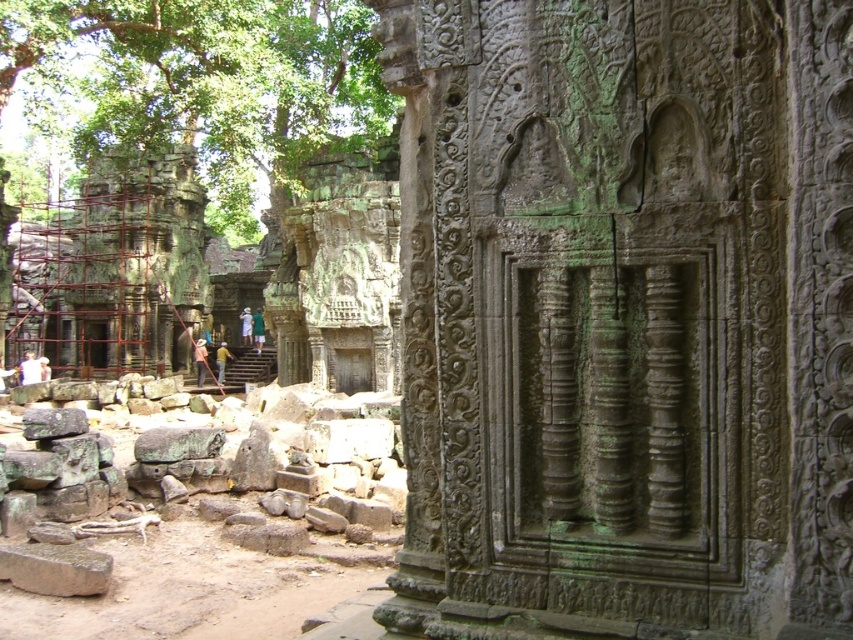
Which is behind, point (543, 328) or point (265, 125)?

The point (265, 125) is more distant.

Does green stone carving at center appear over green mossy stone at upper left?

Actually, green stone carving at center is below green mossy stone at upper left.

You are a GUI agent. You are given a task and a screenshot of the screen. Output one action in this format:
    pyautogui.click(x=<x>, y=<y>)
    Task: Click on the green stone carving at center
    
    Given the screenshot: What is the action you would take?
    pyautogui.click(x=624, y=317)